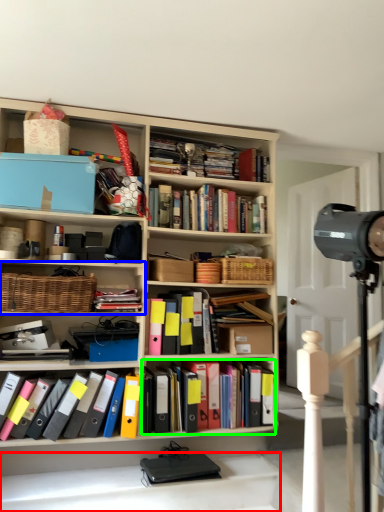
Question: Which is nearer to the stairwell (highlighted by a red box)? shelf (highlighted by a blue box) or book (highlighted by a green box).

Choices:
 (A) shelf
 (B) book

Answer: (B)